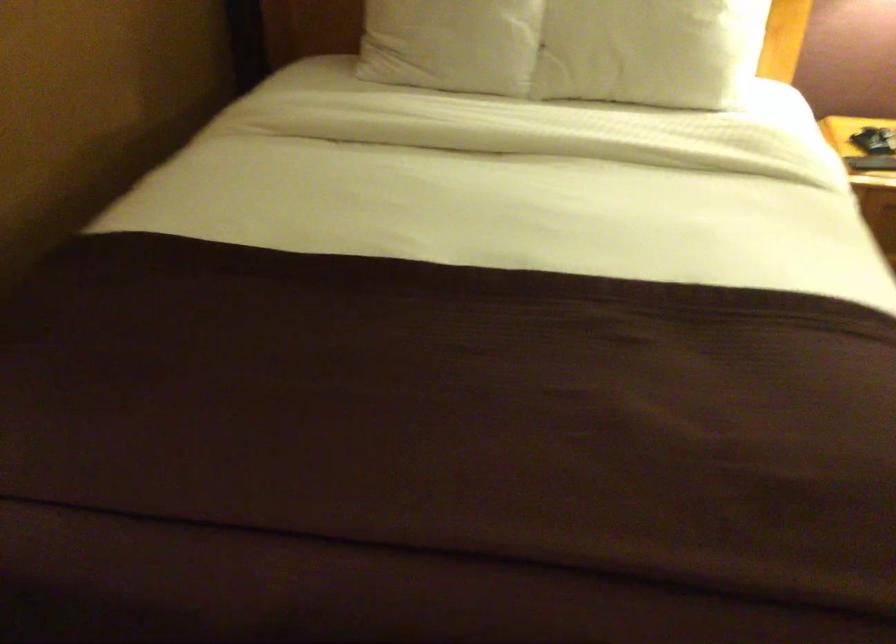
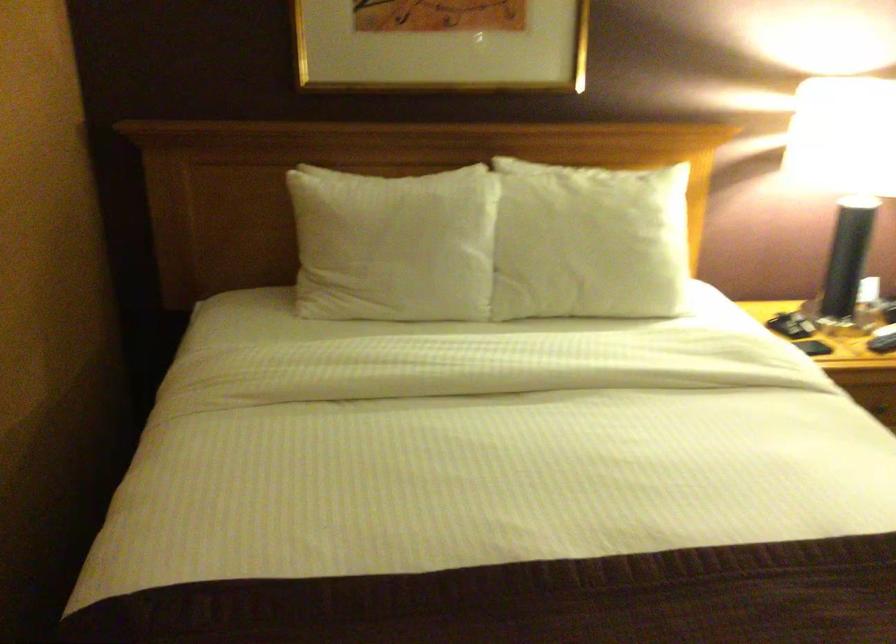
What movement of the cameraman would produce the second image?

The cameraman moved toward left, forward.